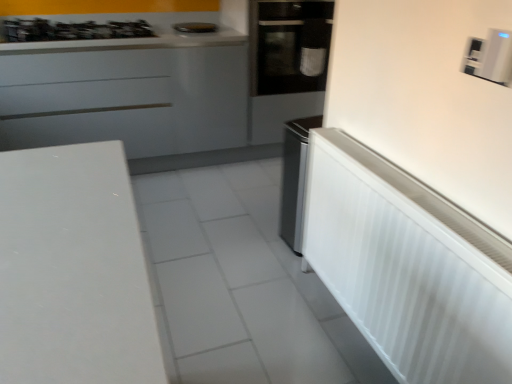
Locate an element on the screen. The height and width of the screenshot is (384, 512). free region under metallic silver toaster at upper center, the third appliance positioned from the right (from a real-world perspective) is located at coordinates (195, 26).